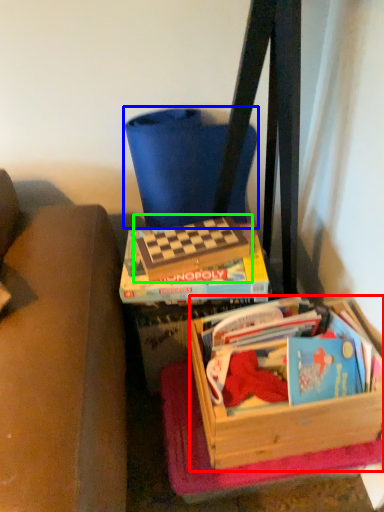
Question: Which is farther away from box (highlighted by a red box)? folding chair (highlighted by a blue box) or paperback book (highlighted by a green box)?

Choices:
 (A) folding chair
 (B) paperback book

Answer: (A)